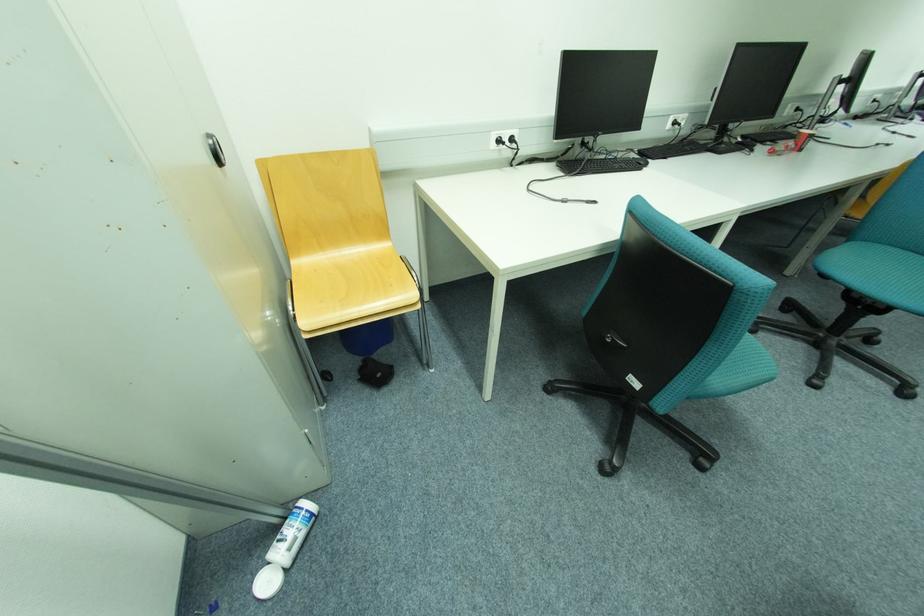
Find the location of a particular element. The height and width of the screenshot is (616, 924). teal chair sitting surface is located at coordinates (896, 277).